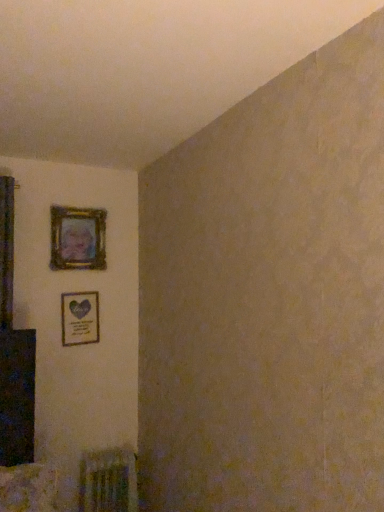
Question: Is metallic silver radiator at lower left at the back of wooden frame at upper left, which ranks as the 1th picture frame in top-to-bottom order?

Choices:
 (A) yes
 (B) no

Answer: (B)

Question: Could you tell me if wooden frame at upper left, which ranks as the 1th picture frame in top-to-bottom order, is facing metallic silver radiator at lower left?

Choices:
 (A) no
 (B) yes

Answer: (A)

Question: Is the surface of wooden frame at upper left, which ranks as the 1th picture frame in top-to-bottom order, in direct contact with metallic silver radiator at lower left?

Choices:
 (A) no
 (B) yes

Answer: (A)

Question: From the image's perspective, is wooden frame at upper left, which appears as the second picture frame when ordered from the bottom, beneath metallic silver radiator at lower left?

Choices:
 (A) yes
 (B) no

Answer: (B)

Question: Is the position of wooden frame at upper left, which ranks as the 1th picture frame in top-to-bottom order, more distant than that of metallic silver radiator at lower left?

Choices:
 (A) no
 (B) yes

Answer: (B)

Question: Is matte gold picture frame at upper left, arranged as the first picture frame when ordered from the bottom, wider or thinner than metallic silver radiator at lower left?

Choices:
 (A) thin
 (B) wide

Answer: (A)

Question: From the image's perspective, is matte gold picture frame at upper left, placed as the 2th picture frame when sorted from top to bottom, positioned above or below metallic silver radiator at lower left?

Choices:
 (A) above
 (B) below

Answer: (A)

Question: Considering the relative positions of matte gold picture frame at upper left, placed as the 2th picture frame when sorted from top to bottom, and metallic silver radiator at lower left in the image provided, is matte gold picture frame at upper left, placed as the 2th picture frame when sorted from top to bottom, to the left or to the right of metallic silver radiator at lower left?

Choices:
 (A) left
 (B) right

Answer: (A)

Question: Is matte gold picture frame at upper left, placed as the 2th picture frame when sorted from top to bottom, bigger or smaller than metallic silver radiator at lower left?

Choices:
 (A) big
 (B) small

Answer: (B)

Question: Considering their positions, is wooden frame at upper left, which ranks as the 1th picture frame in top-to-bottom order, located in front of or behind matte gold picture frame at upper left, placed as the 2th picture frame when sorted from top to bottom?

Choices:
 (A) front
 (B) behind

Answer: (A)

Question: Choose the correct answer: Is wooden frame at upper left, which ranks as the 1th picture frame in top-to-bottom order, inside matte gold picture frame at upper left, placed as the 2th picture frame when sorted from top to bottom, or outside it?

Choices:
 (A) outside
 (B) inside

Answer: (A)

Question: Looking at their shapes, would you say wooden frame at upper left, which appears as the second picture frame when ordered from the bottom, is wider or thinner than matte gold picture frame at upper left, placed as the 2th picture frame when sorted from top to bottom?

Choices:
 (A) thin
 (B) wide

Answer: (B)

Question: From a real-world perspective, is wooden frame at upper left, which ranks as the 1th picture frame in top-to-bottom order, physically located above or below matte gold picture frame at upper left, placed as the 2th picture frame when sorted from top to bottom?

Choices:
 (A) above
 (B) below

Answer: (A)

Question: In the image, is wooden frame at upper left, which appears as the second picture frame when ordered from the bottom, positioned in front of or behind metallic silver radiator at lower left?

Choices:
 (A) front
 (B) behind

Answer: (B)

Question: Based on their positions, is wooden frame at upper left, which ranks as the 1th picture frame in top-to-bottom order, located to the left or right of metallic silver radiator at lower left?

Choices:
 (A) right
 (B) left

Answer: (B)